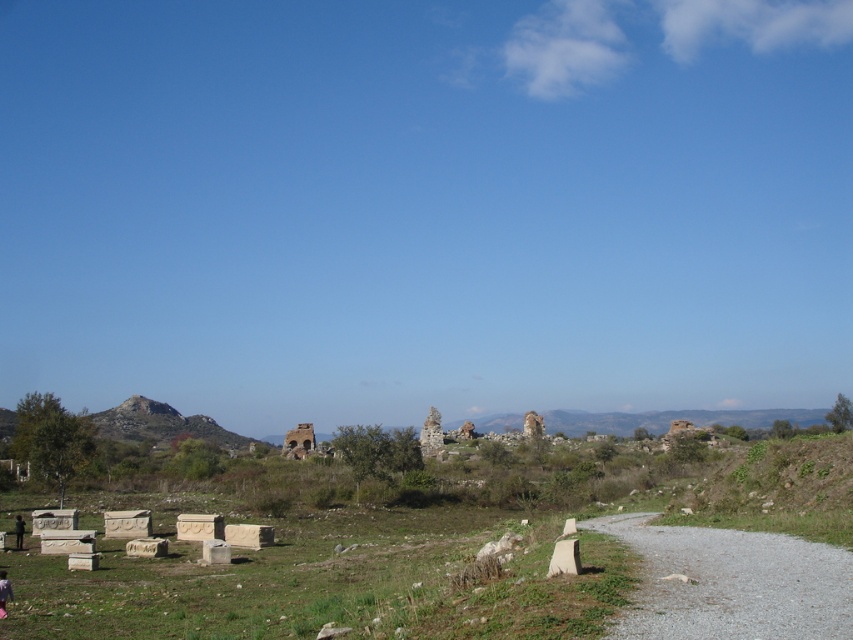
You are a hiker carrying a backpack and need to decide between taking the gravelly dirt path at lower right or the dark green fabric at lower left. Which option is shorter in height?

The gravelly dirt path at lower right is not as tall as the dark green fabric at lower left, so the gravelly dirt path at lower right is shorter in height.

From the picture: You are a tourist standing at the point marked by the coordinates point (x=431, y=433) in the image. What can you see around you?

You are at the point (x=431, y=433), which is the location of weathered stone ruins at center. The scene around you includes ancient ruins scattered across a grassy field under a clear blue sky, gravel paths, distant hills, and a mix of grassy and rocky terrain.

You are a hiker wearing the pink fabric pants at lower left and want to walk along the gravelly dirt path at lower right. Based on the scene description, can you step onto the path directly from your current position?

The gravelly dirt path at lower right is above the pink fabric pants at lower left, so yes, you can step onto the path directly from your current position since the path is elevated and accessible.